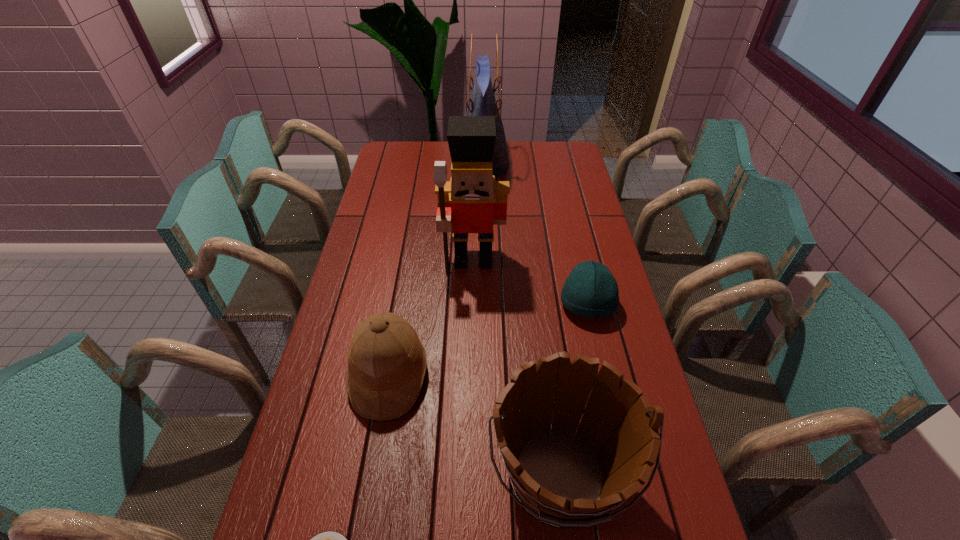
You are a GUI agent. You are given a task and a screenshot of the screen. Output one action in this format:
    pyautogui.click(x=<x>, y=<y>)
    Task: Click on the shopping bag
    The height and width of the screenshot is (540, 960).
    Given the screenshot: What is the action you would take?
    pyautogui.click(x=482, y=102)

Find the location of `the fifth nearest object`. the fifth nearest object is located at coordinates (472, 201).

Where is `the third shortest object`? This screenshot has width=960, height=540. the third shortest object is located at coordinates tap(387, 363).

Image resolution: width=960 pixels, height=540 pixels. Identify the location of the fifth tallest object. (590, 290).

The image size is (960, 540). I want to click on beanie, so click(590, 290).

At what (x,y) coordinates should I click in order to perform the action: click on vacant area situated 0.130m on the front of the shopping bag. Please return your answer as a coordinate pair (x, y). The height and width of the screenshot is (540, 960). Looking at the image, I should click on (483, 206).

Locate an element on the screen. free space located 0.100m in front of the nutcracker holding the staff is located at coordinates (x=472, y=302).

The height and width of the screenshot is (540, 960). I want to click on free space located 0.170m on the front-facing side of the hat, so click(x=492, y=376).

Locate an element on the screen. The width and height of the screenshot is (960, 540). free space located 0.090m on the left of the beanie is located at coordinates (531, 304).

At what (x,y) coordinates should I click in order to perform the action: click on object at the far edge. Please return your answer as a coordinate pair (x, y). The height and width of the screenshot is (540, 960). Looking at the image, I should click on (482, 102).